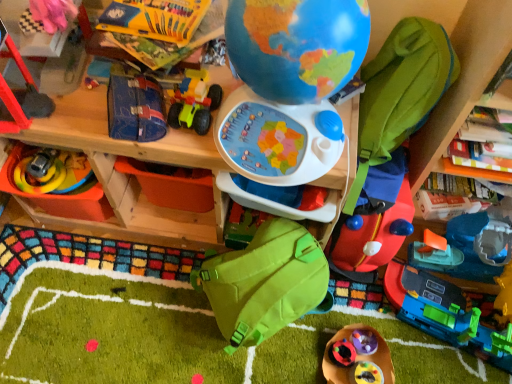
At what (x,y) coordinates should I click in order to perform the action: click on free space to the left of blue fabric case at center, positioned as the 9th toy in right-to-left order. Please return your answer as a coordinate pair (x, y). The width and height of the screenshot is (512, 384). Looking at the image, I should click on (76, 103).